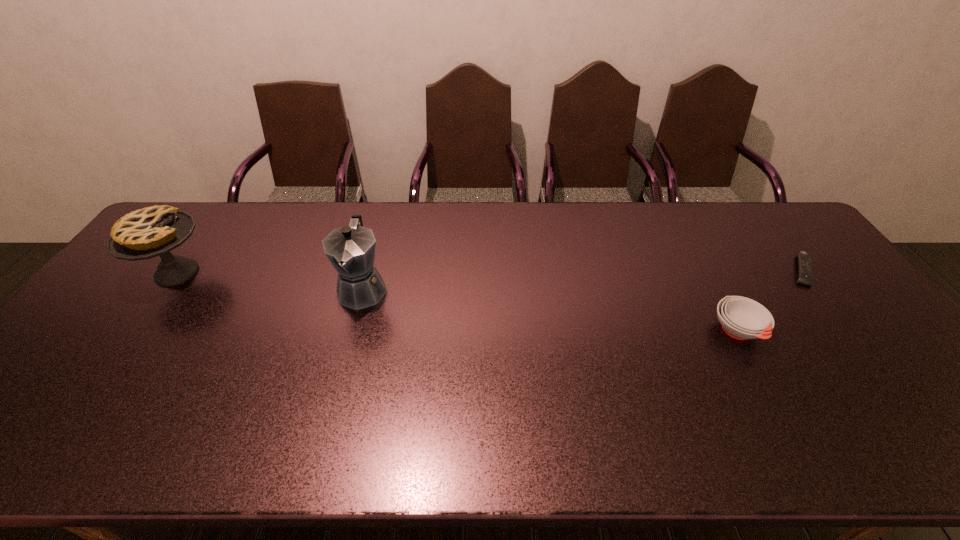
Locate an element on the screen. free area in between the soup bowl and the coffeepot is located at coordinates (550, 309).

Locate an element on the screen. This screenshot has height=540, width=960. free space between the soup bowl and the leftmost object is located at coordinates (457, 302).

Locate an element on the screen. The width and height of the screenshot is (960, 540). vacant area that lies between the rightmost object and the second object from right to left is located at coordinates (770, 300).

Find the location of a particular element. Image resolution: width=960 pixels, height=540 pixels. free space between the rightmost object and the second shortest object is located at coordinates (770, 300).

Identify the location of unoccupied area between the third tallest object and the coffeepot. (550, 309).

Identify the location of unoccupied position between the soup bowl and the shortest object. (770, 300).

In order to click on free spot between the rightmost object and the second object from left to right in this screenshot , I will do `click(583, 279)`.

This screenshot has width=960, height=540. Identify the location of vacant area that lies between the third shortest object and the second shortest object. (457, 302).

Find the location of a particular element. The height and width of the screenshot is (540, 960). empty space that is in between the pie and the remote control is located at coordinates (490, 271).

Identify which object is the second closest to the third object from right to left. Please provide its 2D coordinates. Your answer should be formatted as a tuple, i.e. [(x, y)], where the tuple contains the x and y coordinates of a point satisfying the conditions above.

[(741, 318)]